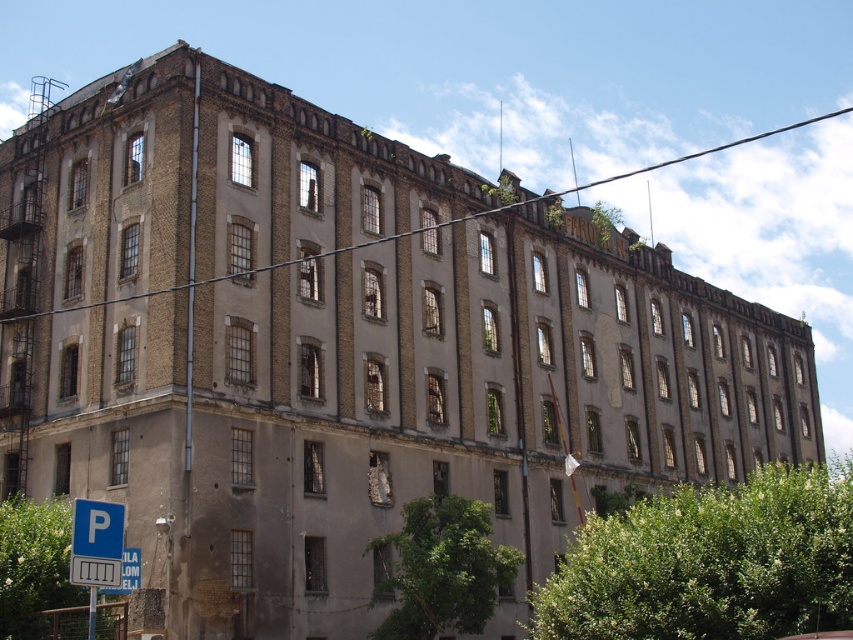
Which is in front, point (93, 525) or point (122, 584)?

Point (93, 525) is more forward.

Consider the image. Does blue plastic parking sign at lower left appear over blue plastic street sign at lower left?

Indeed, blue plastic parking sign at lower left is positioned over blue plastic street sign at lower left.

In order to click on blue plastic parking sign at lower left in this screenshot , I will do `click(96, 544)`.